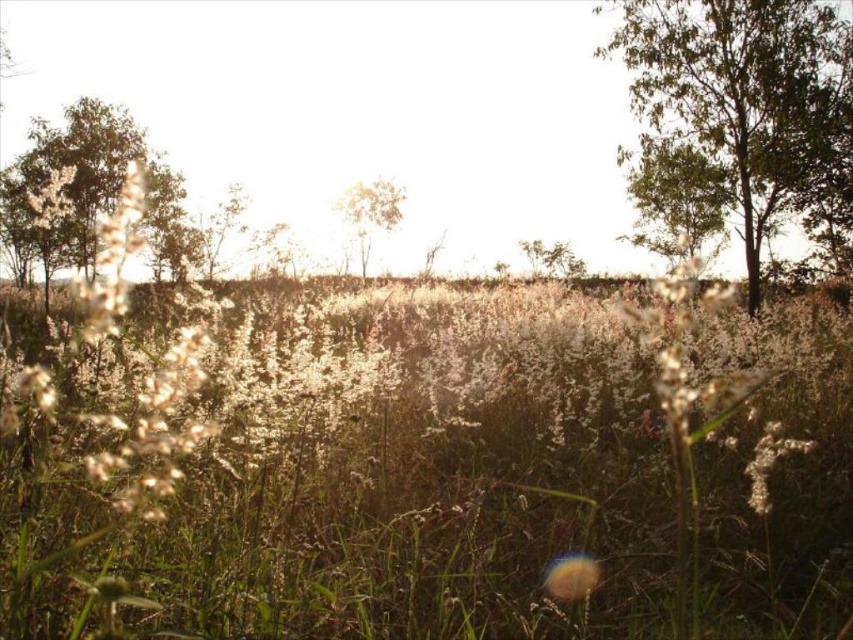
You are a bird looking for a nesting spot. You see the green leafy tree at upper right and the brown wood tree at center. Which tree is taller and better for nesting?

The brown wood tree at center is taller than the green leafy tree at upper right, so it would be better for nesting.

You are standing in the serene natural landscape described. You notice two points in the scene. The first is at coordinate point (392, 216) and the second at point (560, 272). Which of these two points is closer to your current position?

Point (392, 216) is closer to the viewer than point (560, 272).

You are standing in the serene natural landscape shown in the image. You see a point marked at coordinates (80, 180). What object does this point correspond to?

The point corresponds to the green matte tree at left.